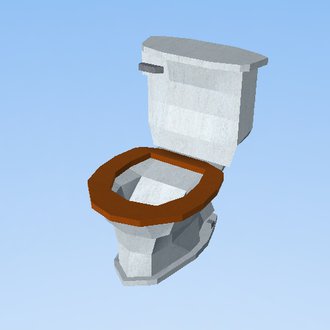
You are a GUI agent. You are given a task and a screenshot of the screen. Output one action in this format:
    pyautogui.click(x=<x>, y=<y>)
    Task: Click on the bottom of toilet
    The width and height of the screenshot is (330, 330).
    Given the screenshot: What is the action you would take?
    pyautogui.click(x=156, y=277)